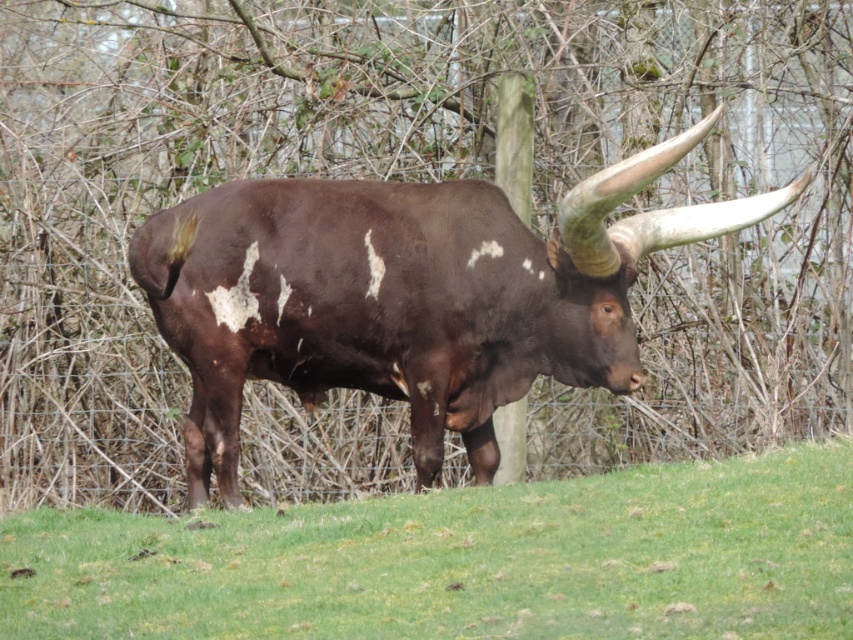
You are a photographer trying to capture the bull in the image. You notice the green grass at center and the brown glossy bull at center. Which object is more to the left?

The green grass at center is positioned on the left side of brown glossy bull at center, so the green grass at center is more to the left.

You are a farmer checking the enclosure. You see the green grass at center and the brown glossy bull at center. Which one is taller?

The green grass at center is shorter than the brown glossy bull at center, so the brown glossy bull at center is taller.

You are standing in front of the bull in the fenced enclosure. You notice two points marked in the image. The first point is at coordinate point(260, 508) and the second is at point(225, 224). Which point is closer to you?

Point(260, 508) is further to the viewer than point(225, 224), so the point closer to you is point(225, 224).